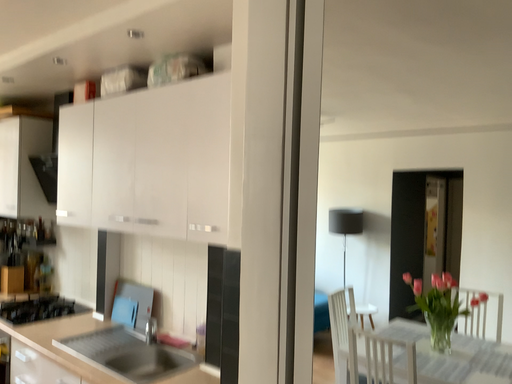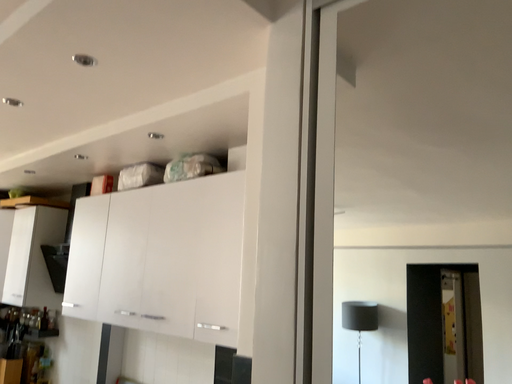
Question: How did the camera likely rotate when shooting the video?

Choices:
 (A) rotated upward
 (B) rotated downward

Answer: (A)